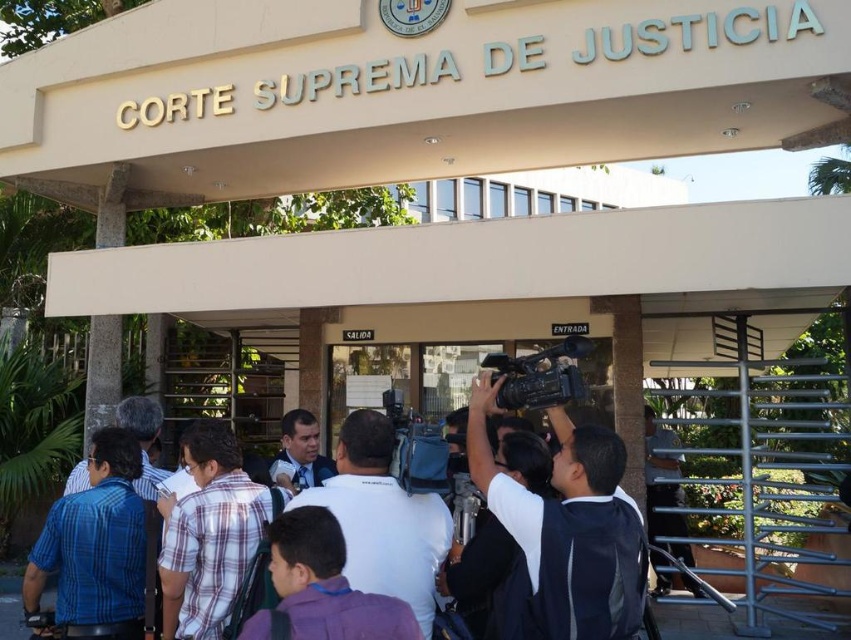
Does point (634, 513) come farther from viewer compared to point (580, 396)?

No, it is in front of (580, 396).

Identify the location of white shirt at center. This screenshot has width=851, height=640. (503, 483).

Does point (563, 460) come farther from viewer compared to point (495, 355)?

No, (563, 460) is closer to viewer.

Find the location of a particular element. The height and width of the screenshot is (640, 851). white shirt at center is located at coordinates (503, 483).